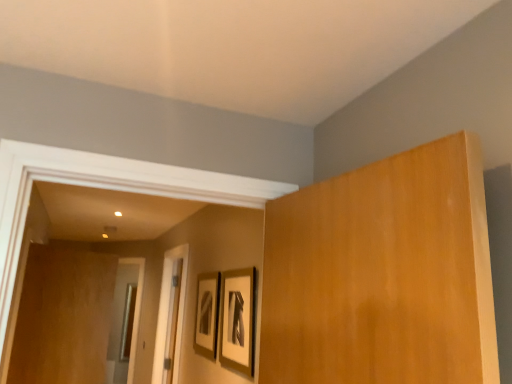
Question: Considering the relative positions of matte black picture frame at center, marked as the 2th picture frame in a front-to-back arrangement, and brown wood door at left in the image provided, is matte black picture frame at center, marked as the 2th picture frame in a front-to-back arrangement, to the left or to the right of brown wood door at left?

Choices:
 (A) right
 (B) left

Answer: (A)

Question: Considering the positions of matte black picture frame at center, the first picture frame viewed from the back, and brown wood door at left in the image, is matte black picture frame at center, the first picture frame viewed from the back, taller or shorter than brown wood door at left?

Choices:
 (A) tall
 (B) short

Answer: (B)

Question: Which is farther from the matte black picture frame at center, which is the first picture frame from right to left?

Choices:
 (A) brown wood door at left
 (B) matte black picture frame at center, the first picture frame viewed from the back

Answer: (A)

Question: Which object is positioned farthest from the brown wood door at left?

Choices:
 (A) matte black picture frame at center, the first picture frame in the left-to-right sequence
 (B) matte black picture frame at center, the second picture frame viewed from the left

Answer: (B)